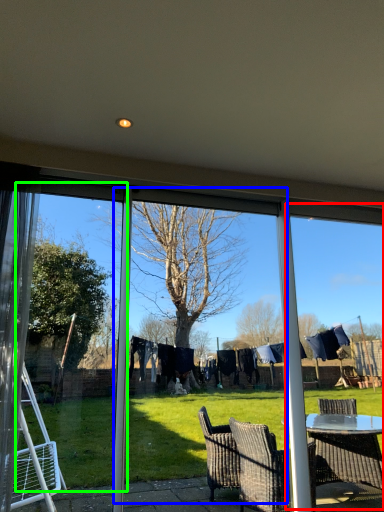
Question: Which is farther away from window frame (highlighted by a red box)? screen door (highlighted by a blue box) or screen door (highlighted by a green box)?

Choices:
 (A) screen door
 (B) screen door

Answer: (A)